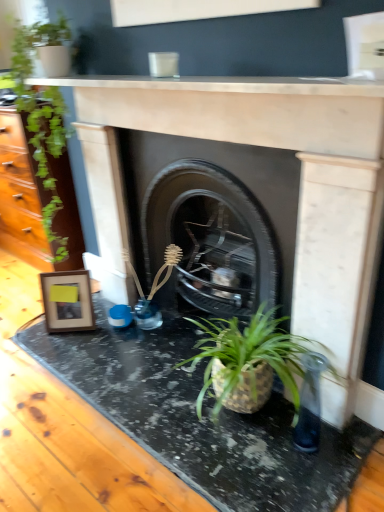
Find the location of a particular element. vacant space situated above white marble fireplace at upper center, acting as the 1th counter top starting from the top (from a real-world perspective) is located at coordinates (203, 76).